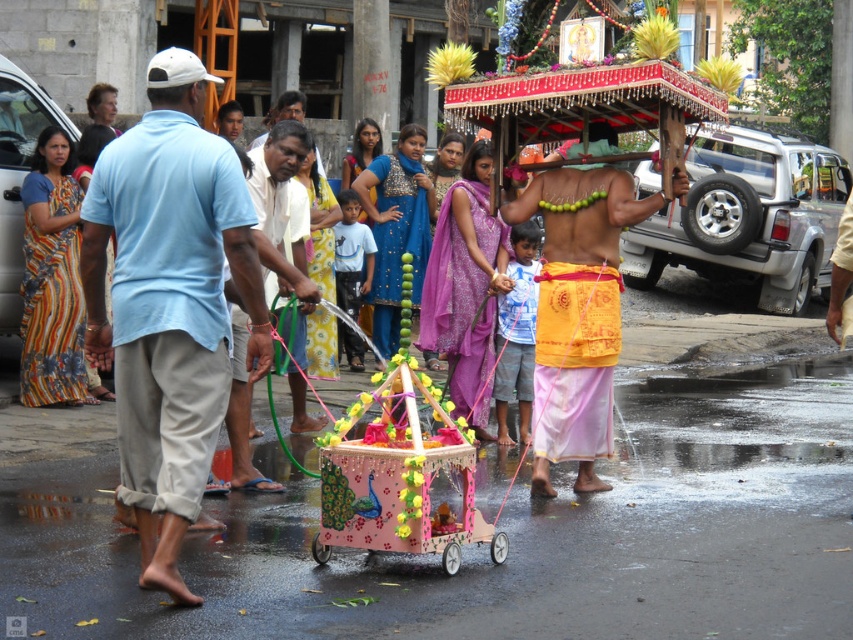
You are a photographer standing in the middle of the street. You want to take a photo of the light blue cotton shirt at left and the pastel pink wooden cart at center. Which object will appear larger in your photo?

The light blue cotton shirt at left is closer to the viewer than the pastel pink wooden cart at center, so it will appear larger in the photo.

You are standing in front of the decorated cart and want to know which of the two points, point (140,134) or point (340,540), is nearer to you. Can you determine this based on their positions?

Point (140,134) is closer to the camera than point (340,540), so it is nearer to you.